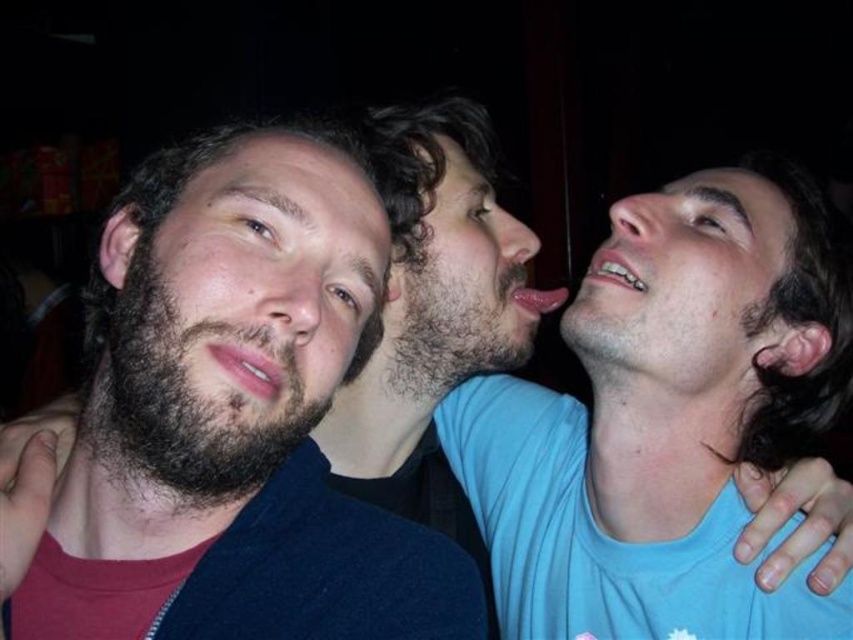
Which of these two, dark brown hair at center or white glossy teeth at upper right, stands shorter?

white glossy teeth at upper right

Is the position of dark brown hair at center more distant than that of white glossy teeth at upper right?

That is True.

What do you see at coordinates (463, 280) in the screenshot? I see `dark brown hair at center` at bounding box center [463, 280].

Locate an element on the screen. Image resolution: width=853 pixels, height=640 pixels. dark brown hair at center is located at coordinates [463, 280].

Is pink matte lips at center smaller than glossy pink lips at center?

Yes, pink matte lips at center is smaller than glossy pink lips at center.

Between point (207, 349) and point (531, 310), which one is positioned behind?

Positioned behind is point (531, 310).

The width and height of the screenshot is (853, 640). What are the coordinates of `pink matte lips at center` in the screenshot? It's located at (252, 365).

Does dark brown fuzzy beard at center lie in front of white glossy teeth at upper right?

That is False.

Measure the distance from dark brown fuzzy beard at center to white glossy teeth at upper right.

dark brown fuzzy beard at center is 7.08 inches away from white glossy teeth at upper right.

Where is `dark brown fuzzy beard at center`? The image size is (853, 640). dark brown fuzzy beard at center is located at coordinates (456, 321).